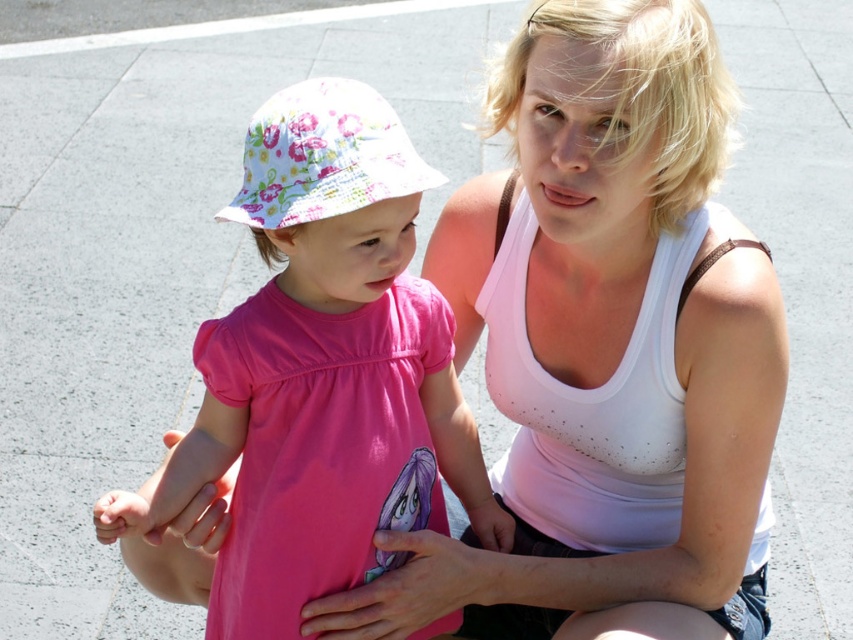
Does pink fabric dress at center appear over white matte tank top at center?

Yes.

Which is behind, point (483, 528) or point (759, 637)?

The point (759, 637) is more distant.

Image resolution: width=853 pixels, height=640 pixels. Identify the location of pink fabric dress at center. (323, 371).

Can you confirm if pink fabric dress at center is positioned above pink matte dress at center?

Yes.

Who is more forward, (409, 403) or (393, 513)?

Point (409, 403) is in front.

Between point (286, 136) and point (422, 525), which one is positioned in front?

Point (286, 136)

Image resolution: width=853 pixels, height=640 pixels. What are the coordinates of `pink fabric dress at center` in the screenshot? It's located at (323, 371).

Is pink matte dress at center wider than white matte tank top at center?

No, pink matte dress at center is not wider than white matte tank top at center.

Who is positioned more to the left, pink matte dress at center or white matte tank top at center?

From the viewer's perspective, pink matte dress at center appears more on the left side.

The height and width of the screenshot is (640, 853). In order to click on pink matte dress at center in this screenshot , I will do click(x=321, y=445).